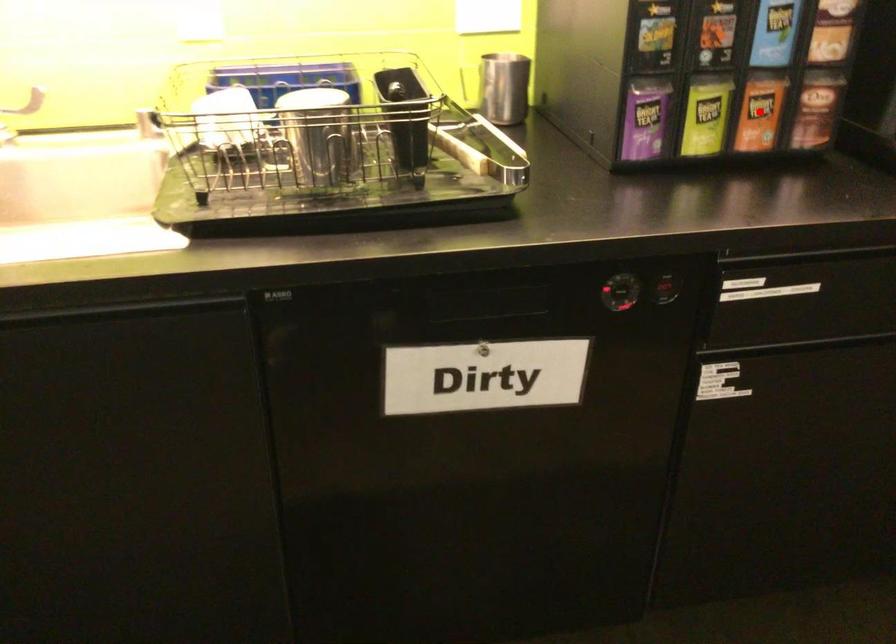
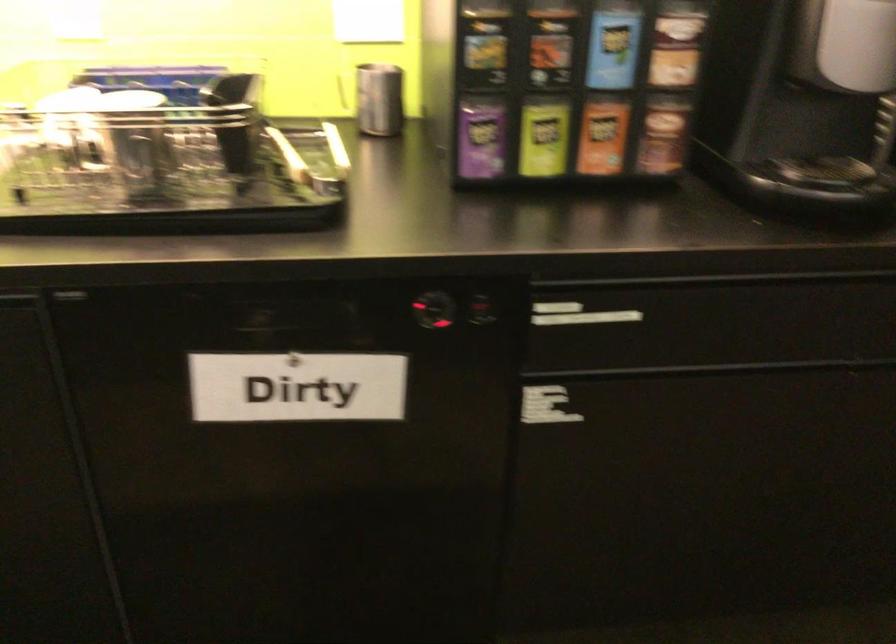
The point at the highlighted location is marked in the first image. Where is the corresponding point in the second image?

(602, 136)